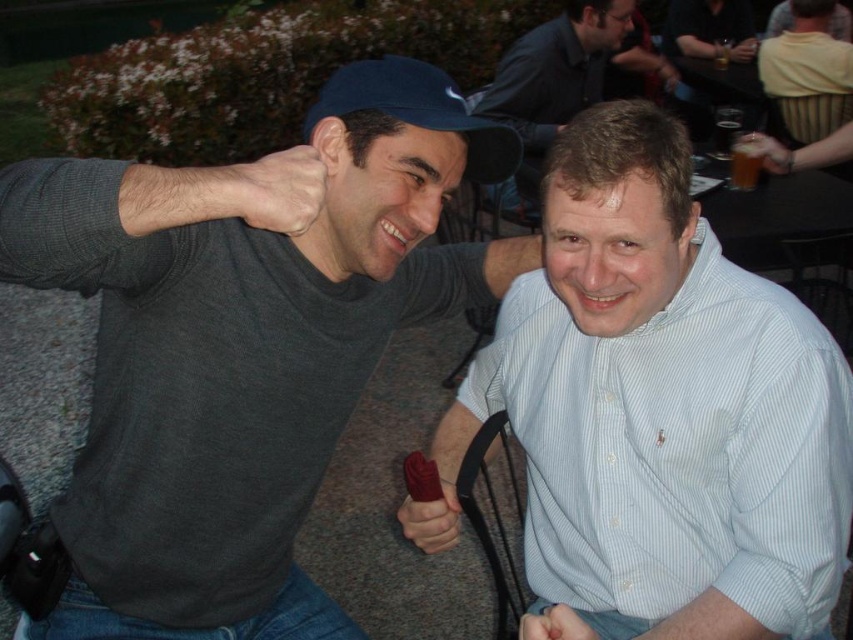
Question: Does matte black hand at lower center have a lesser width compared to translucent glass at upper center?

Choices:
 (A) yes
 (B) no

Answer: (A)

Question: Among these points, which one is farthest from the camera?

Choices:
 (A) (566, 634)
 (B) (494, 147)
 (C) (782, 326)

Answer: (B)

Question: Which of the following is the farthest from the observer?

Choices:
 (A) (432, 484)
 (B) (757, 156)
 (C) (593, 33)

Answer: (C)

Question: From the image, what is the correct spatial relationship of blue matte baseball cap at upper center in relation to matte black fist at lower center?

Choices:
 (A) left
 (B) right

Answer: (A)

Question: Is matte black fist at lower center to the right of translucent glass at upper center from the viewer's perspective?

Choices:
 (A) yes
 (B) no

Answer: (B)

Question: Which object is farther from the camera taking this photo?

Choices:
 (A) skinny white hand at upper center
 (B) blue matte baseball cap at upper center
 (C) matte black fist at lower center
 (D) matte black hand at lower center

Answer: (D)